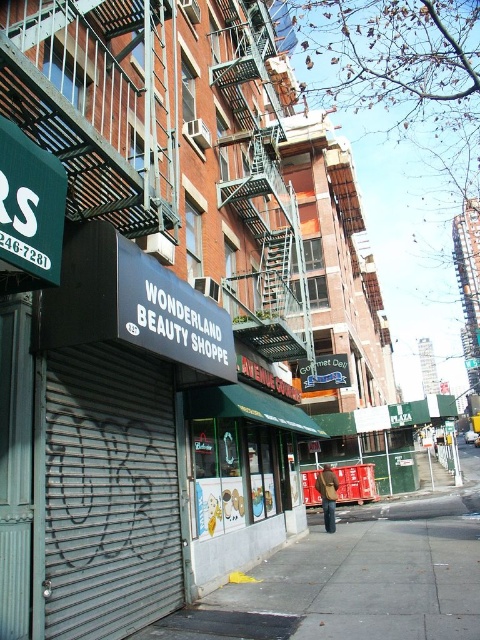
You are a delivery person who needs to park your delivery cart on the sidewalk. The cart requires a space that is wider than the metallic fire escape at upper center. Can you park your cart on the concrete sidewalk at lower center?

The concrete sidewalk at lower center occupies less space than the metallic fire escape at upper center. Therefore, the sidewalk is not wide enough to accommodate the delivery cart, which requires a space wider than the fire escape.

You are standing in front of the Wonderland Beauty Shoppe and want to take a photo that includes both point [372,632] and point [257,60]. Since you want to ensure both points are in focus, which point should you focus on to maximize the depth of field?

You should focus on point [257,60] because it is farther from the camera than point [372,632]. By focusing on the farther point, the depth of field will extend backward to include the closer point as well, ensuring both are in focus.

You are a delivery person trying to reach the Wonderland Beauty Shoppe located at the lower center of the image. You see the concrete sidewalk at lower center and the metallic fire escape at upper center. Which object is closer to the shoppe?

The concrete sidewalk at lower center is closer to the Wonderland Beauty Shoppe because it is located below the metallic fire escape at upper center, which is positioned higher up on the building.